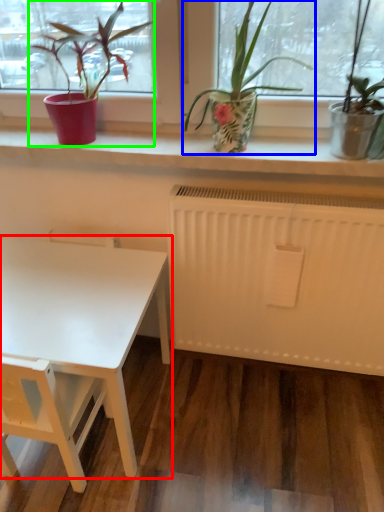
Question: Which is farther away from table (highlighted by a red box)? houseplant (highlighted by a blue box) or houseplant (highlighted by a green box)?

Choices:
 (A) houseplant
 (B) houseplant

Answer: (A)